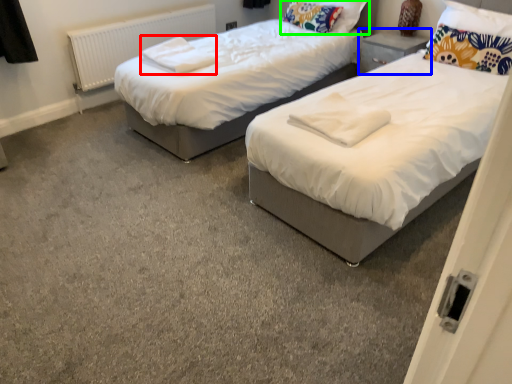
Question: Which object is the closest to the linen (highlighted by a red box)? Choose among these: nightstand (highlighted by a blue box) or pillow (highlighted by a green box).

Choices:
 (A) nightstand
 (B) pillow

Answer: (B)